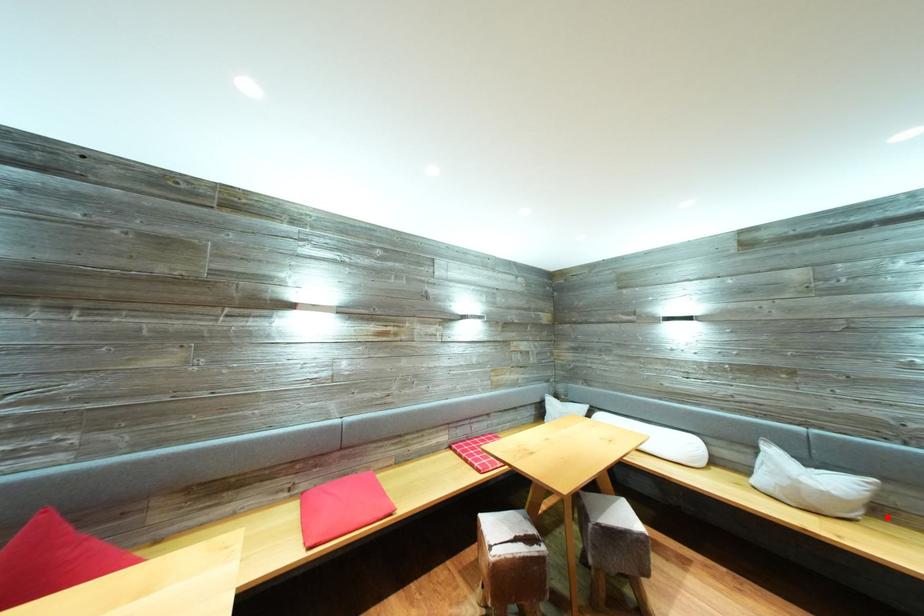
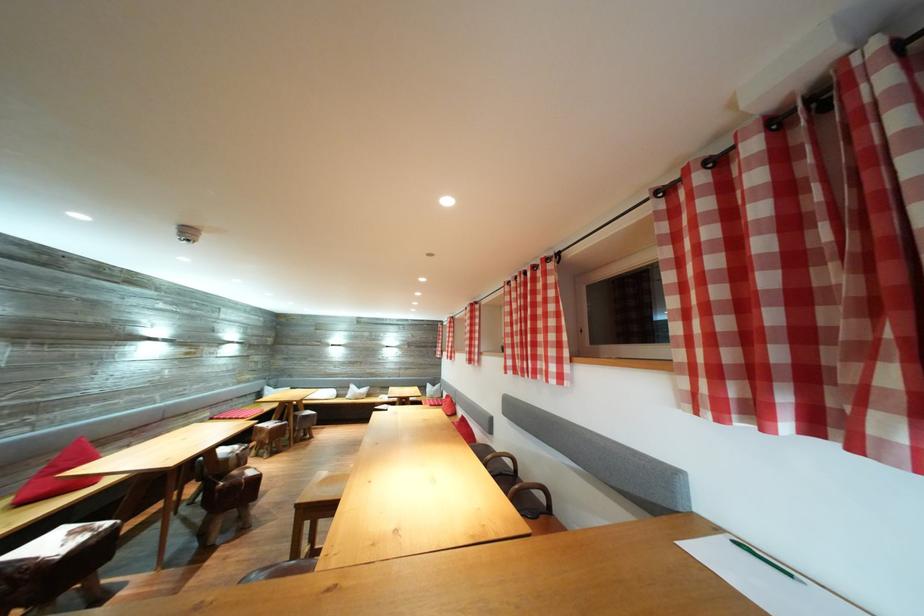
Question: A red point is marked in image1. In image2, is the corresponding 3D point closer to the camera or farther? Reply with the corresponding letter.

Choices:
 (A) The corresponding 3D point is closer.
 (B) The corresponding 3D point is farther.

Answer: (B)